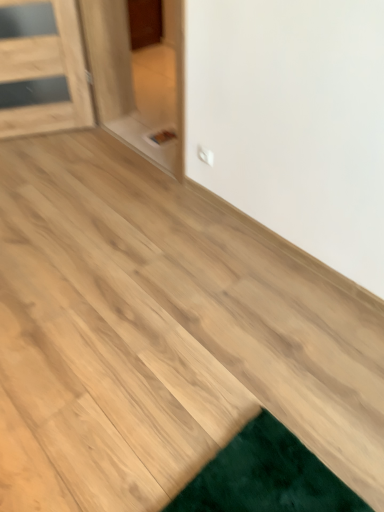
Describe the element at coordinates (139, 74) in the screenshot. I see `transparent glass door at center` at that location.

The width and height of the screenshot is (384, 512). I want to click on transparent glass door at center, so click(x=139, y=74).

What do you see at coordinates (162, 335) in the screenshot? I see `natural wood floor at center` at bounding box center [162, 335].

Where is `natural wood floor at center`? natural wood floor at center is located at coordinates (162, 335).

Image resolution: width=384 pixels, height=512 pixels. I want to click on transparent glass door at center, so click(139, 74).

Can you confirm if natural wood floor at center is positioned to the right of transparent glass door at center?

In fact, natural wood floor at center is to the left of transparent glass door at center.

Which is behind, natural wood floor at center or transparent glass door at center?

transparent glass door at center is more distant.

Between point (91, 408) and point (133, 27), which one is positioned behind?

Point (133, 27)

In the scene shown: From the image's perspective, is natural wood floor at center located above transparent glass door at center?

No, from the image's perspective, natural wood floor at center is not over transparent glass door at center.

From a real-world perspective, is natural wood floor at center over transparent glass door at center?

No, from a real-world perspective, natural wood floor at center is not over transparent glass door at center

Based on the photo, is natural wood floor at center thinner than transparent glass door at center?

No.

From their relative heights in the image, would you say natural wood floor at center is taller or shorter than transparent glass door at center?

In the image, natural wood floor at center appears to be shorter than transparent glass door at center.

Between natural wood floor at center and transparent glass door at center, which one has smaller size?

With smaller size is natural wood floor at center.

Is natural wood floor at center inside or outside of transparent glass door at center?

natural wood floor at center cannot be found inside transparent glass door at center.

From the picture: Is the surface of natural wood floor at center in direct contact with transparent glass door at center?

No, natural wood floor at center is not beside transparent glass door at center.

Is natural wood floor at center aimed at transparent glass door at center?

No, natural wood floor at center is not aimed at transparent glass door at center.

Measure the distance between natural wood floor at center and transparent glass door at center.

natural wood floor at center and transparent glass door at center are 3.90 feet apart from each other.

This screenshot has width=384, height=512. I want to click on glass door that is behind the natural wood floor at center, so click(x=139, y=74).

Considering the positions of objects transparent glass door at center and natural wood floor at center in the image provided, who is more to the right, transparent glass door at center or natural wood floor at center?

transparent glass door at center.

Is the depth of transparent glass door at center less than that of natural wood floor at center?

No, transparent glass door at center is further to the viewer.

Between point (181, 106) and point (101, 446), which one is positioned in front?

Point (101, 446)

From the image's perspective, is transparent glass door at center located above or below natural wood floor at center?

Clearly, from the image's perspective, transparent glass door at center is above natural wood floor at center.

From a real-world perspective, between transparent glass door at center and natural wood floor at center, who is vertically lower?

From a 3D spatial view, natural wood floor at center is below.

Which object is wider, transparent glass door at center or natural wood floor at center?

natural wood floor at center.

Between transparent glass door at center and natural wood floor at center, which one has less height?

Standing shorter between the two is natural wood floor at center.

Is transparent glass door at center bigger or smaller than natural wood floor at center?

transparent glass door at center is bigger than natural wood floor at center.

Is transparent glass door at center completely or partially outside of natural wood floor at center?

Absolutely, transparent glass door at center is external to natural wood floor at center.

Based on the photo, is the surface of transparent glass door at center in direct contact with natural wood floor at center?

No, transparent glass door at center is not making contact with natural wood floor at center.

Is transparent glass door at center oriented away from natural wood floor at center?

No.

What's the angular difference between transparent glass door at center and natural wood floor at center's facing directions?

The angle between the facing direction of transparent glass door at center and the facing direction of natural wood floor at center is 179 degrees.

From the picture: Measure the distance from transparent glass door at center to natural wood floor at center.

They are 3.90 feet apart.

In the image, there is a natural wood floor at center. At what (x,y) coordinates should I click in order to perform the action: click on glass door above it (from the image's perspective). Please return your answer as a coordinate pair (x, y). The width and height of the screenshot is (384, 512). Looking at the image, I should click on (139, 74).

Locate an element on the screen. The height and width of the screenshot is (512, 384). glass door on the right of the natural wood floor at center is located at coordinates (139, 74).

Locate an element on the screen. This screenshot has height=512, width=384. glass door above the natural wood floor at center (from a real-world perspective) is located at coordinates point(139,74).